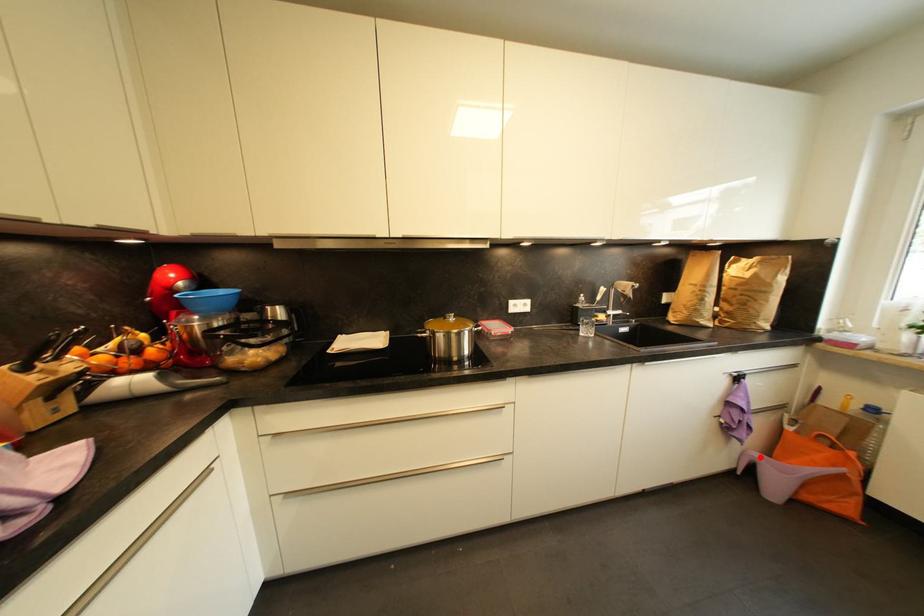
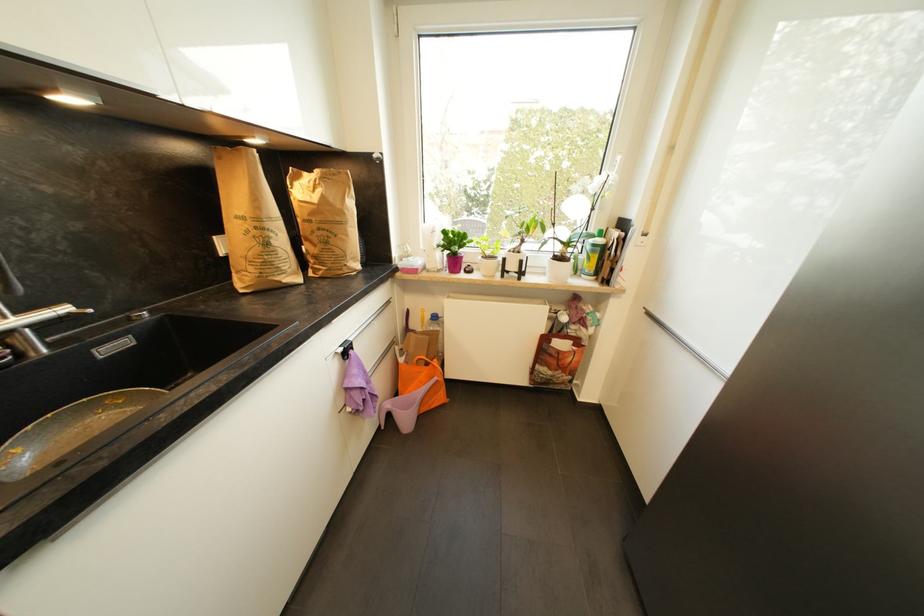
The point at the highlighted location is marked in the first image. Where is the corresponding point in the second image?

(393, 407)